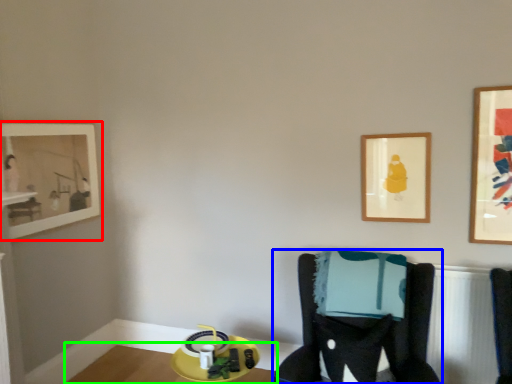
Question: Estimate the real-world distances between objects in this image. Which object is closer to picture frame (highlighted by a red box), furniture (highlighted by a blue box) or table (highlighted by a green box)?

Choices:
 (A) furniture
 (B) table

Answer: (B)